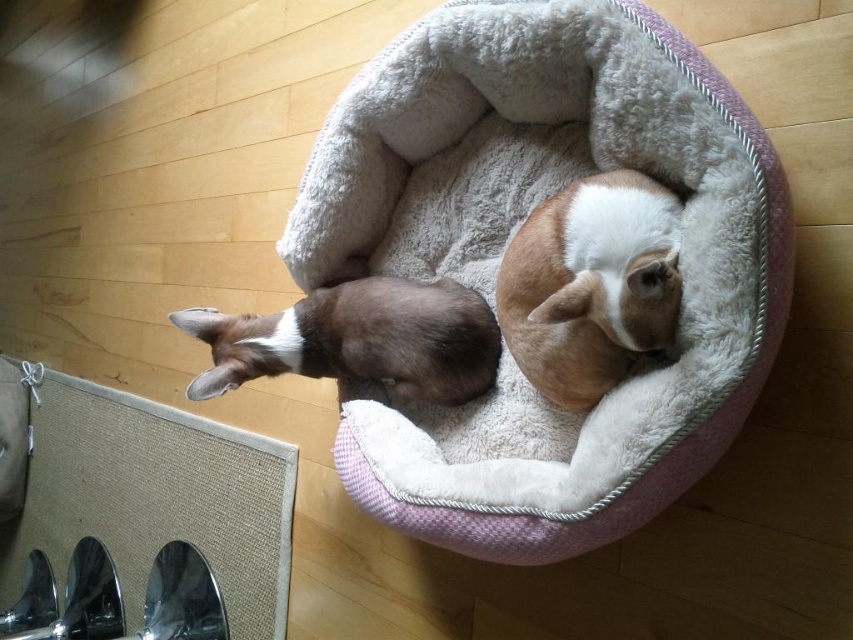
Question: Among these points, which one is farthest from the camera?

Choices:
 (A) (570, 396)
 (B) (305, 328)
 (C) (552, 51)

Answer: (B)

Question: Can you confirm if brown fuzzy dog at center is wider than brown fur dog at left?

Choices:
 (A) yes
 (B) no

Answer: (B)

Question: Does soft gray plush cat bed at center have a greater width compared to brown fur dog at left?

Choices:
 (A) yes
 (B) no

Answer: (A)

Question: Is soft gray plush cat bed at center closer to camera compared to brown fur dog at left?

Choices:
 (A) yes
 (B) no

Answer: (A)

Question: Which point is farther from the camera taking this photo?

Choices:
 (A) 527,243
 (B) 718,198

Answer: (A)

Question: Which of the following is the closest to the observer?

Choices:
 (A) brown fuzzy dog at center
 (B) soft gray plush cat bed at center
 (C) brown fur dog at left

Answer: (A)